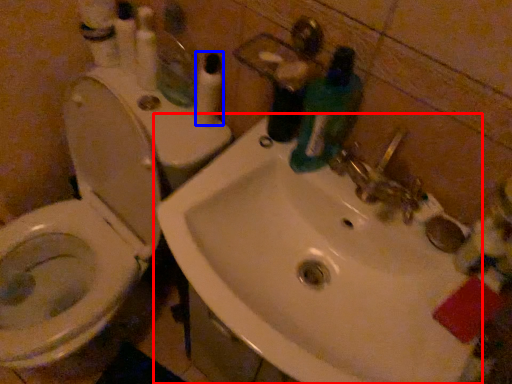
Question: Which object is closer to the camera taking this photo, sink (highlighted by a red box) or toiletry (highlighted by a blue box)?

Choices:
 (A) sink
 (B) toiletry

Answer: (A)